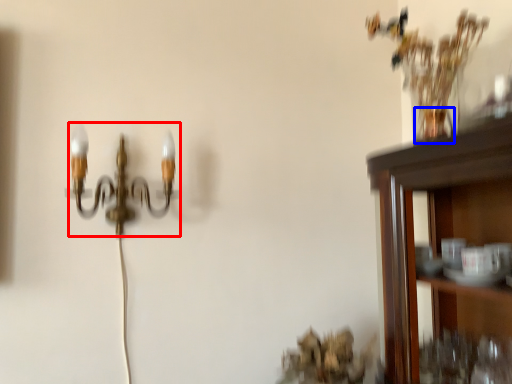
Question: Which object appears closest to the camera in this image, lamp (highlighted by a red box) or vase (highlighted by a blue box)?

Choices:
 (A) lamp
 (B) vase

Answer: (B)